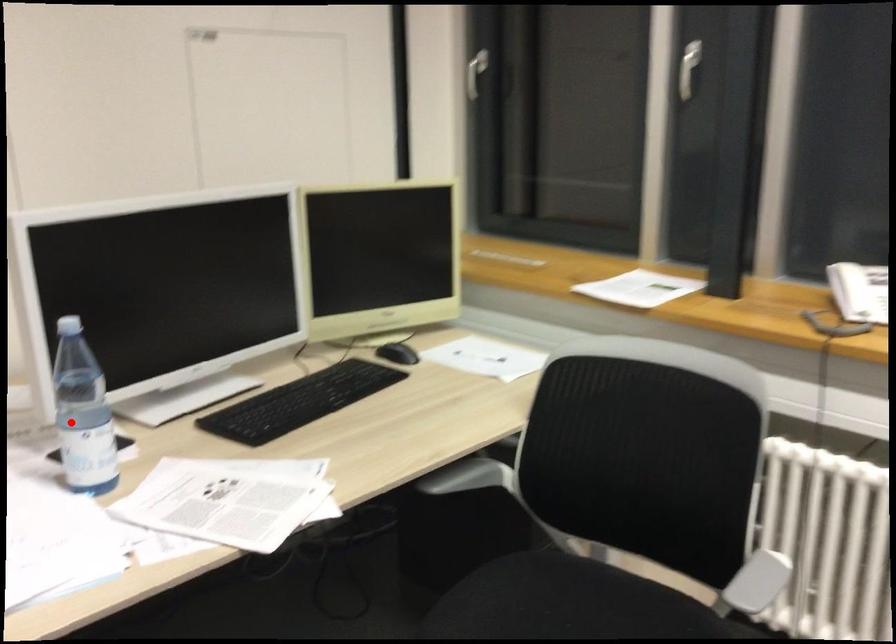
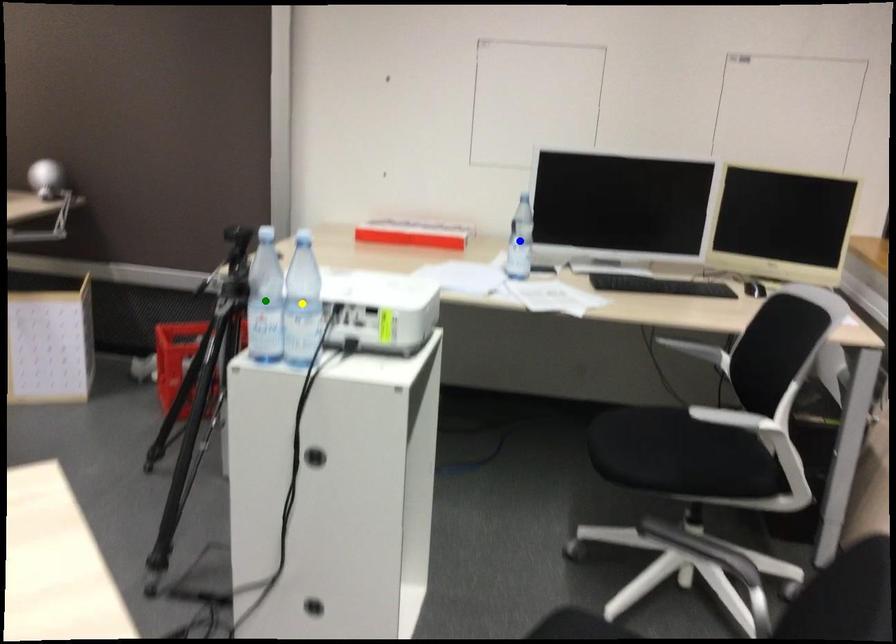
Question: I am providing you with two images of the same scene from different viewpoints. A red point is marked on the first image. You are given multiple points on the second image. Which point in image 2 is actually the same real-world point as the red point in image 1?

Choices:
 (A) yellow point
 (B) green point
 (C) blue point

Answer: (C)